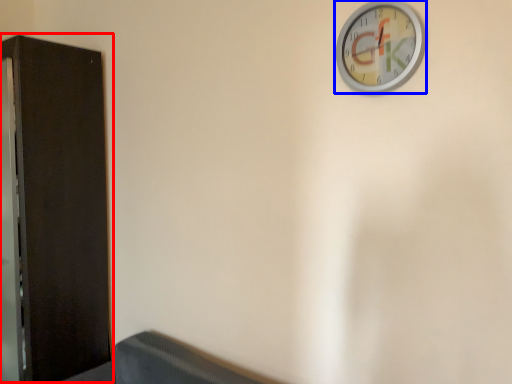
Question: Which of the following is the closest to the observer, dresser (highlighted by a red box) or wall clock (highlighted by a blue box)?

Choices:
 (A) dresser
 (B) wall clock

Answer: (B)